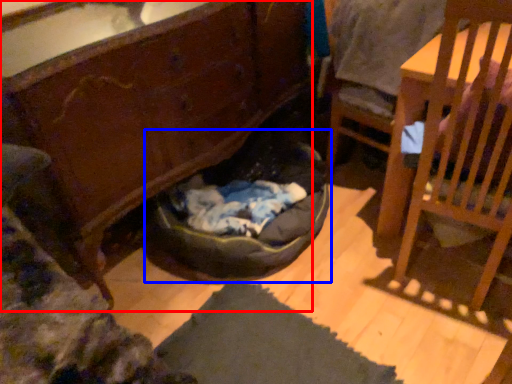
Question: Among these objects, which one is farthest to the camera, cabinetry (highlighted by a red box) or bean bag chair (highlighted by a blue box)?

Choices:
 (A) cabinetry
 (B) bean bag chair

Answer: (B)